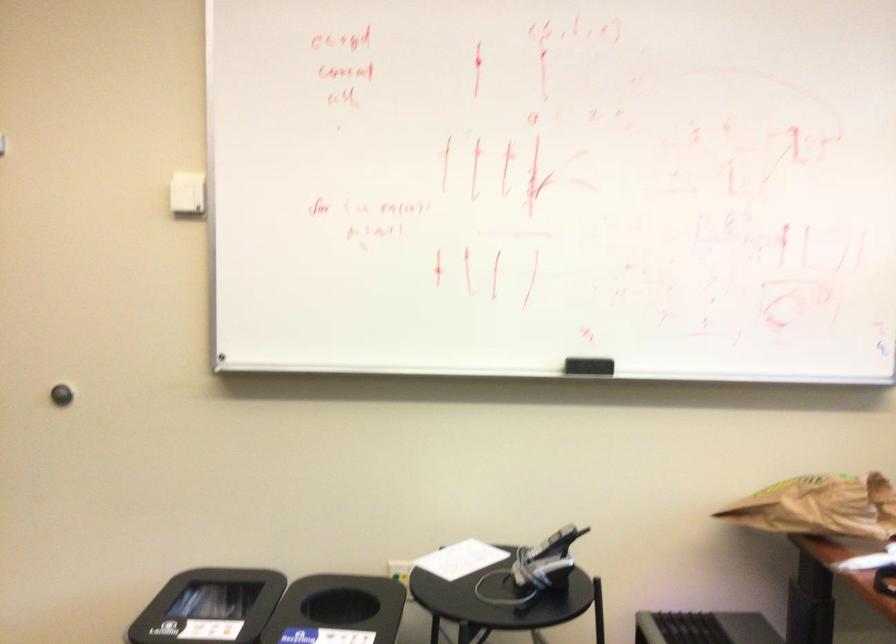
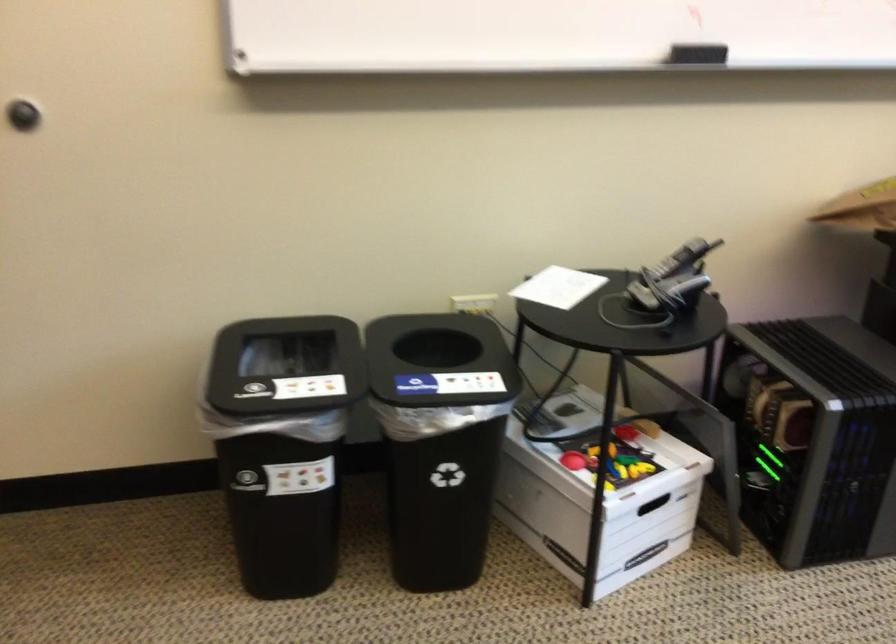
Question: Based on the continuous images, in which direction is the camera rotating? Reply with the corresponding letter.

Choices:
 (A) Left
 (B) Right
 (C) Up
 (D) Down

Answer: (D)